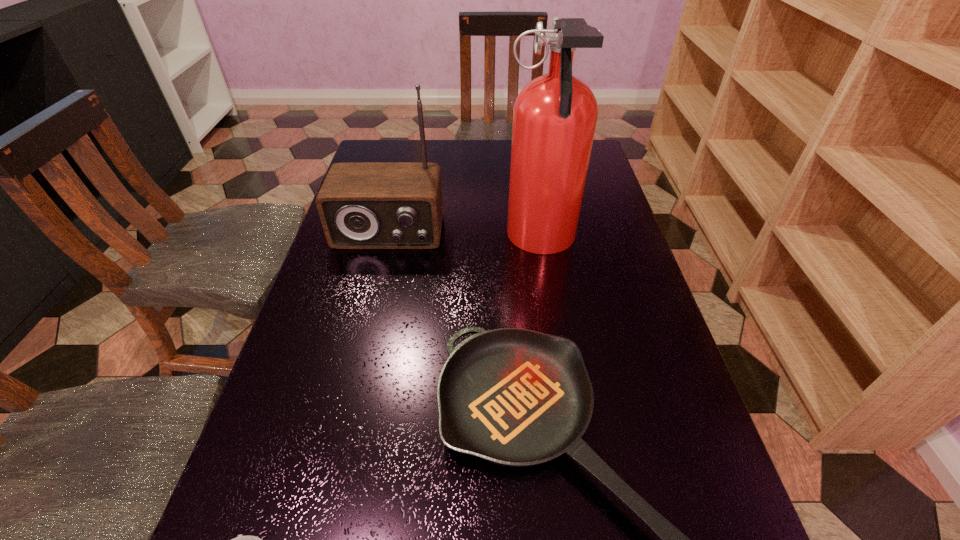
The width and height of the screenshot is (960, 540). I want to click on vacant area between the fire extinguisher and the radio receiver, so 465,237.

Image resolution: width=960 pixels, height=540 pixels. In order to click on free space between the tallest object and the radio receiver in this screenshot , I will do `click(465, 237)`.

Locate which object is the closest to the radio receiver. Please provide its 2D coordinates. Your answer should be formatted as a tuple, i.e. [(x, y)], where the tuple contains the x and y coordinates of a point satisfying the conditions above.

[(554, 116)]

You are a GUI agent. You are given a task and a screenshot of the screen. Output one action in this format:
    pyautogui.click(x=<x>, y=<y>)
    Task: Click on the object identified as the third closest to the third shortest object
    
    Given the screenshot: What is the action you would take?
    pyautogui.click(x=241, y=539)

In order to click on free space that satisfies the following two spatial constraints: 1. on the front-facing side of the radio receiver; 2. on the right side of the tallest object in this screenshot , I will do `click(387, 241)`.

Find the location of a particular element. The width and height of the screenshot is (960, 540). free region that satisfies the following two spatial constraints: 1. on the front-facing side of the tallest object; 2. on the right side of the radio receiver is located at coordinates (387, 241).